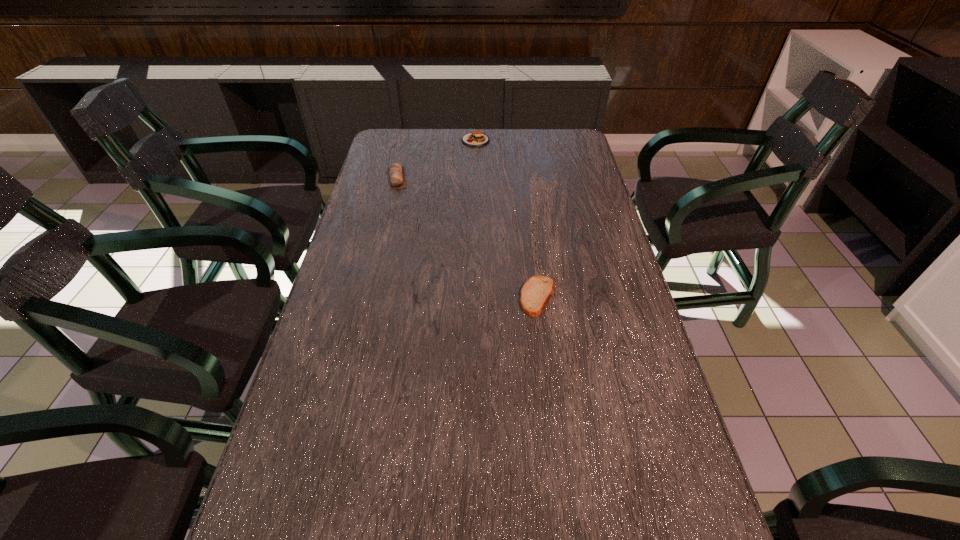
At what (x,y) coordinates should I click in order to perform the action: click on vacant area that lies between the second object from left to right and the shorter pita bread. Please return your answer as a coordinate pair (x, y). Looking at the image, I should click on (507, 219).

Where is `empty space that is in between the farther pita bread and the right pita bread`? Image resolution: width=960 pixels, height=540 pixels. empty space that is in between the farther pita bread and the right pita bread is located at coordinates (468, 238).

Identify the location of free spot between the farther pita bread and the nearest object. The height and width of the screenshot is (540, 960). click(x=468, y=238).

Where is `unoccupied position between the second object from left to right and the left pita bread`? This screenshot has width=960, height=540. unoccupied position between the second object from left to right and the left pita bread is located at coordinates (436, 159).

You are a GUI agent. You are given a task and a screenshot of the screen. Output one action in this format:
    pyautogui.click(x=<x>, y=<y>)
    Task: Click on the vacant region between the patty (food) and the right pita bread
    The height and width of the screenshot is (540, 960).
    Given the screenshot: What is the action you would take?
    pyautogui.click(x=507, y=219)

The height and width of the screenshot is (540, 960). In order to click on object that stands as the second closest to the farther pita bread in this screenshot , I will do `click(537, 290)`.

In order to click on the second closest object to the shorter pita bread in this screenshot , I will do `click(477, 138)`.

The height and width of the screenshot is (540, 960). In order to click on free location that satisfies the following two spatial constraints: 1. on the back side of the leftmost object; 2. on the left side of the patty (food) in this screenshot , I will do `click(406, 140)`.

Locate an element on the screen. vacant space that satisfies the following two spatial constraints: 1. on the front side of the shorter pita bread; 2. on the right side of the left pita bread is located at coordinates (368, 296).

I want to click on free space that satisfies the following two spatial constraints: 1. on the back side of the second nearest object; 2. on the left side of the second object from left to right, so click(406, 140).